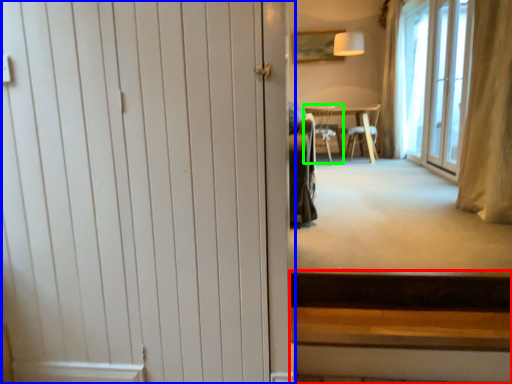
Question: Considering the real-world distances, which object is farthest from stairs (highlighted by a red box)? door (highlighted by a blue box) or chair (highlighted by a green box)?

Choices:
 (A) door
 (B) chair

Answer: (B)